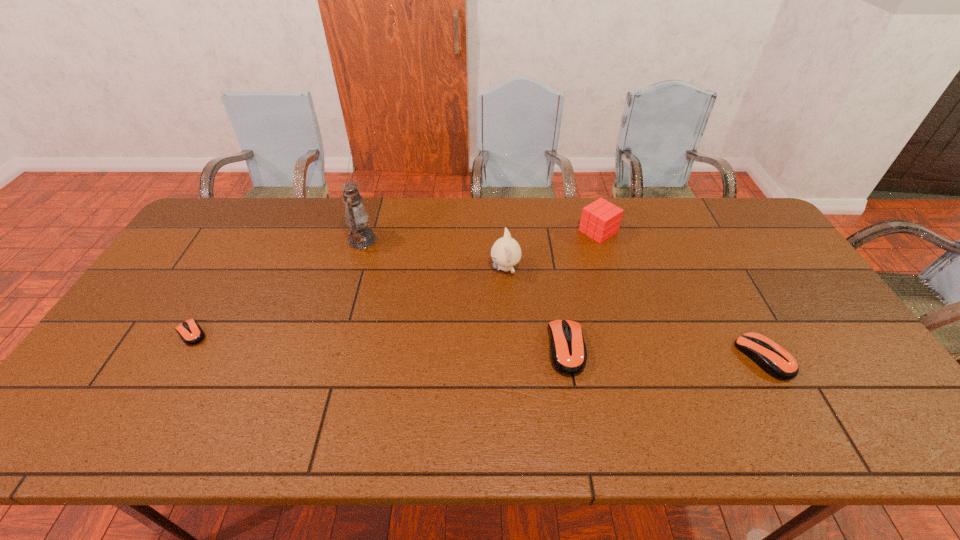
This screenshot has height=540, width=960. Identify the location of cube that is at the far edge. (600, 220).

Locate an element on the screen. object located in the left edge section of the desktop is located at coordinates (190, 332).

Where is `vacant point at the far edge`? vacant point at the far edge is located at coordinates (558, 218).

Find the location of a particular element. vacant space at the near edge of the desktop is located at coordinates (181, 389).

Identify the location of vacant area at the left edge. This screenshot has height=540, width=960. (180, 303).

Locate an element on the screen. Image resolution: width=960 pixels, height=540 pixels. vacant space at the right edge of the desktop is located at coordinates (755, 246).

In the image, there is a desktop. What are the coordinates of `vacant space at the far right corner` in the screenshot? It's located at (726, 241).

You are a GUI agent. You are given a task and a screenshot of the screen. Output one action in this format:
    pyautogui.click(x=<x>, y=<y>)
    Task: Click on the vacant area at the near right corner
    
    Given the screenshot: What is the action you would take?
    pyautogui.click(x=864, y=381)

Find the location of a particular element. free space between the third farthest object and the fifth object from left to right is located at coordinates (552, 250).

This screenshot has width=960, height=540. I want to click on empty location between the oil lamp and the second tallest object, so point(434,254).